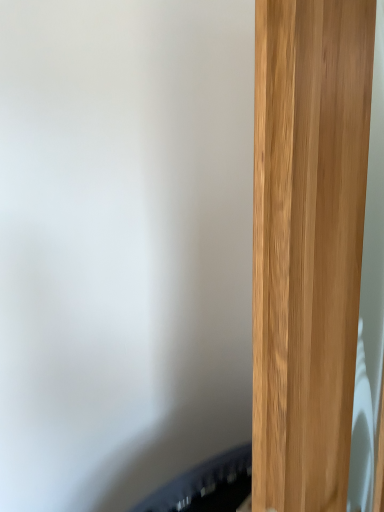
This screenshot has width=384, height=512. What do you see at coordinates (308, 244) in the screenshot?
I see `light brown wood door at right` at bounding box center [308, 244].

Locate an element on the screen. light brown wood door at right is located at coordinates (308, 244).

Find the location of a particular element. The height and width of the screenshot is (512, 384). light brown wood door at right is located at coordinates (x=308, y=244).